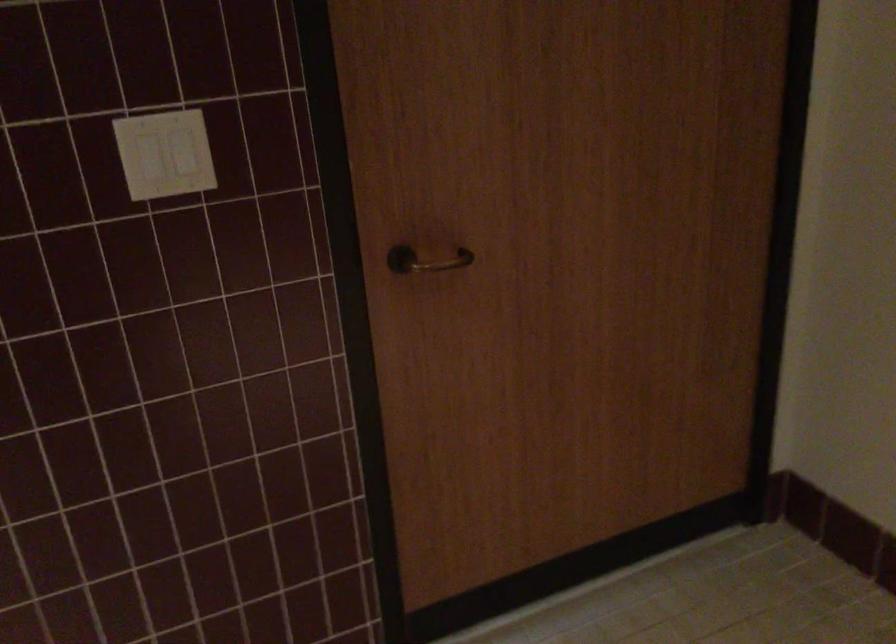
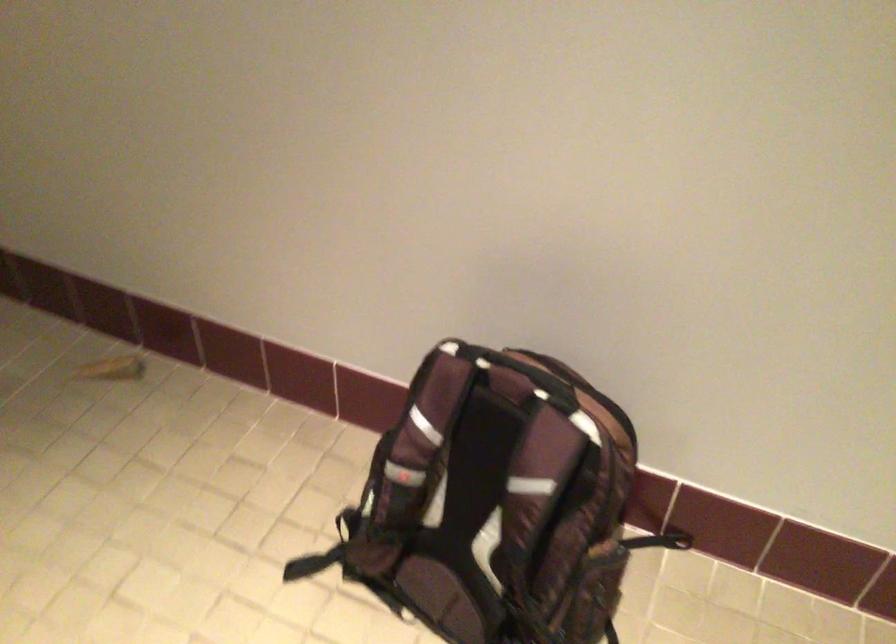
How did the camera likely rotate?

The camera rotated toward right-down.